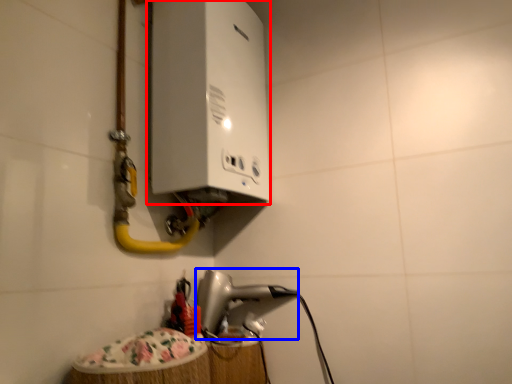
Question: Which object appears closest to the camera in this image, appliance (highlighted by a red box) or appliance (highlighted by a blue box)?

Choices:
 (A) appliance
 (B) appliance

Answer: (A)